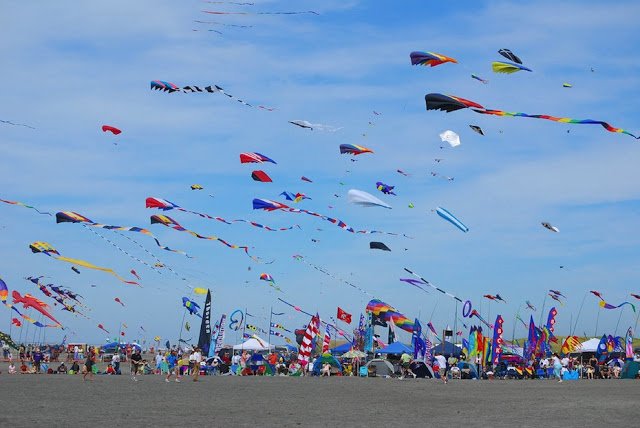
The height and width of the screenshot is (428, 640). Identify the location of white canopy. (248, 347).